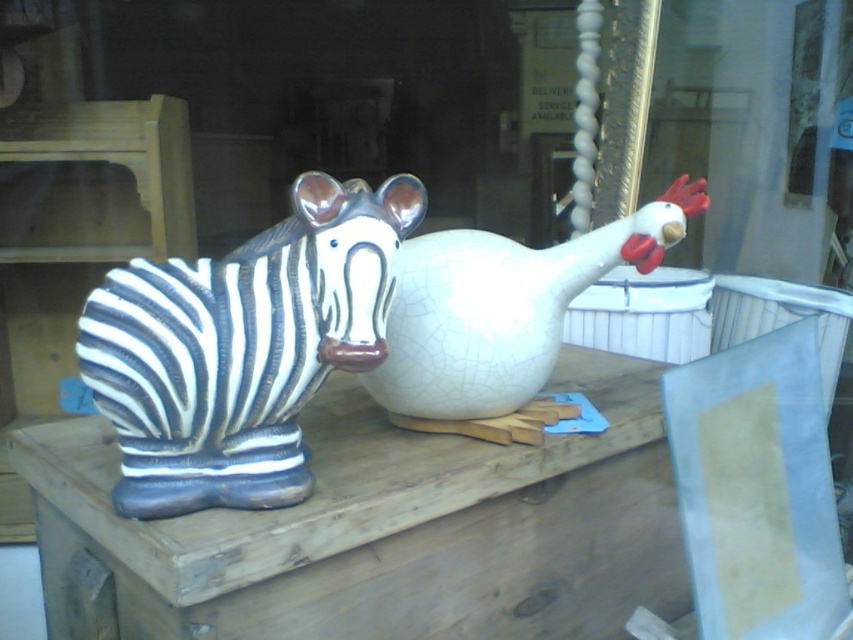
Can you confirm if crackle glaze zebra at center is shorter than crackle glaze zebra statue at left?

Yes.

Which of these two, crackle glaze zebra at center or crackle glaze zebra statue at left, stands shorter?

crackle glaze zebra at center

Which is in front, point (310, 364) or point (100, 220)?

Point (310, 364)

Find the location of a particular element. crackle glaze zebra at center is located at coordinates 241,348.

Which of these two, crackle glaze zebra at center or cracked white vase at center, stands shorter?

cracked white vase at center is shorter.

Does crackle glaze zebra at center come behind cracked white vase at center?

No, it is in front of cracked white vase at center.

Find the location of a particular element. The height and width of the screenshot is (640, 853). crackle glaze zebra at center is located at coordinates (241, 348).

Is point (50, 328) positioned in front of point (599, 236)?

No, (50, 328) is further to viewer.

Consider the image. Does crackle glaze zebra statue at left have a lesser height compared to cracked white vase at center?

No.

Image resolution: width=853 pixels, height=640 pixels. Find the location of `crackle glaze zebra statue at left`. crackle glaze zebra statue at left is located at coordinates (76, 240).